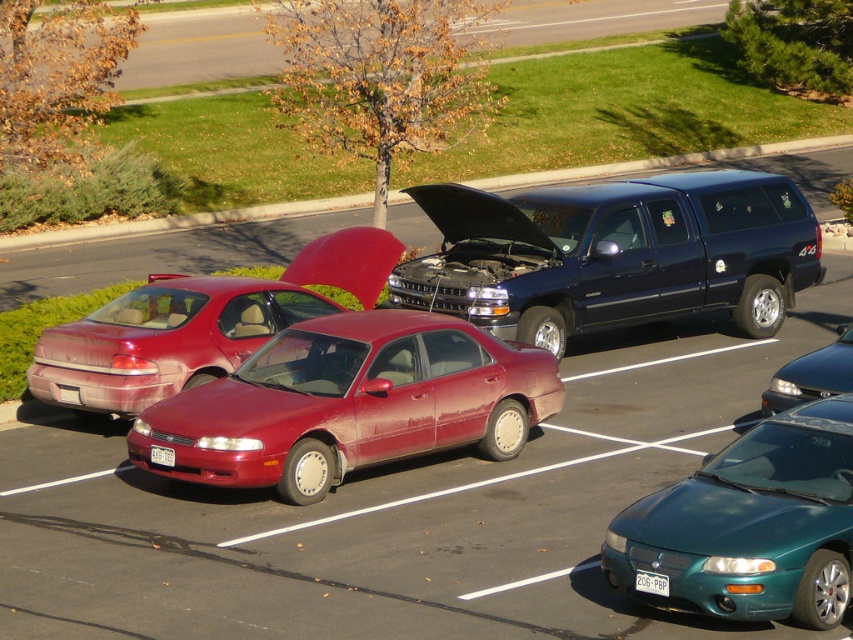
You are a delivery person trying to park your teal glossy sedan at lower right in the parking lot. There is a white plastic license plate at lower center blocking your path. Can you drive around it without going over any obstacles?

The teal glossy sedan at lower right is located below the white plastic license plate at lower center, so you can drive around it by moving to the right side of the white plastic license plate at lower center since it is positioned above the teal glossy sedan.

In the scene shown: What are the coordinates of the white plastic license plate at center?

The white plastic license plate at center is located at coordinates point [651,582].